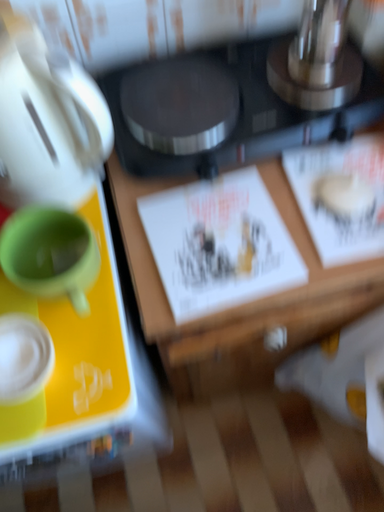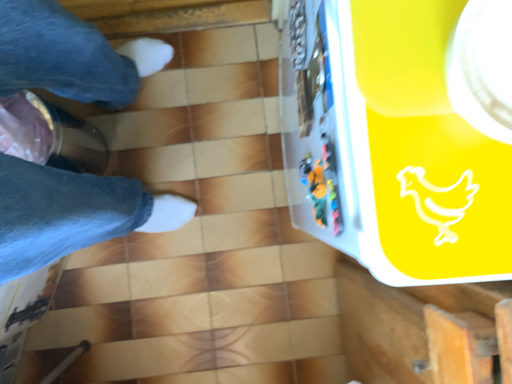
Question: Which way did the camera rotate in the video?

Choices:
 (A) rotated upward
 (B) rotated downward

Answer: (A)